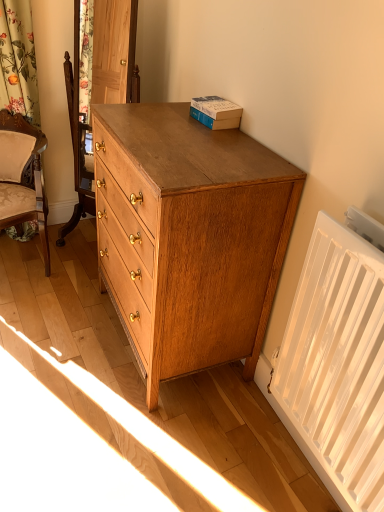
Question: Is white plastic radiator at lower right facing away from matte oak chest of drawers at right?

Choices:
 (A) yes
 (B) no

Answer: (B)

Question: Can you confirm if white plastic radiator at lower right is taller than matte oak chest of drawers at right?

Choices:
 (A) yes
 (B) no

Answer: (B)

Question: Is white plastic radiator at lower right at the right side of matte oak chest of drawers at right?

Choices:
 (A) no
 (B) yes

Answer: (B)

Question: Is white plastic radiator at lower right in contact with matte oak chest of drawers at right?

Choices:
 (A) yes
 (B) no

Answer: (B)

Question: From a real-world perspective, is white plastic radiator at lower right over matte oak chest of drawers at right?

Choices:
 (A) yes
 (B) no

Answer: (A)

Question: Is white plastic radiator at lower right at the left side of matte oak chest of drawers at right?

Choices:
 (A) no
 (B) yes

Answer: (A)

Question: Is beige upholstered chair at left behind hardcover book at upper right?

Choices:
 (A) yes
 (B) no

Answer: (A)

Question: Is beige upholstered chair at left at the right side of hardcover book at upper right?

Choices:
 (A) yes
 (B) no

Answer: (B)

Question: Is beige upholstered chair at left smaller than hardcover book at upper right?

Choices:
 (A) yes
 (B) no

Answer: (B)

Question: Is beige upholstered chair at left beside hardcover book at upper right?

Choices:
 (A) no
 (B) yes

Answer: (A)

Question: Does beige upholstered chair at left turn towards hardcover book at upper right?

Choices:
 (A) yes
 (B) no

Answer: (B)

Question: From a real-world perspective, is beige upholstered chair at left on top of hardcover book at upper right?

Choices:
 (A) no
 (B) yes

Answer: (A)

Question: Can you confirm if hardcover book at upper right is thinner than matte oak chest of drawers at right?

Choices:
 (A) yes
 (B) no

Answer: (A)